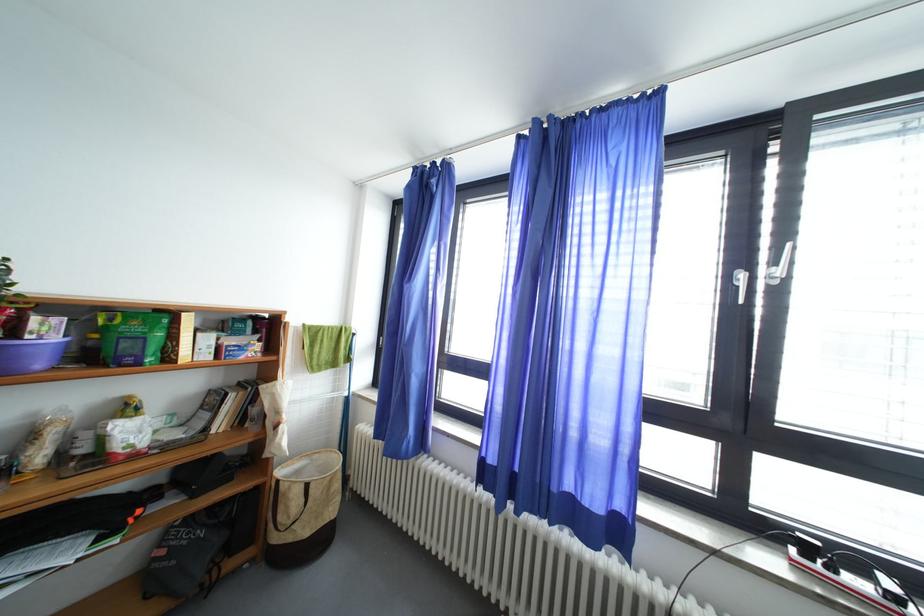
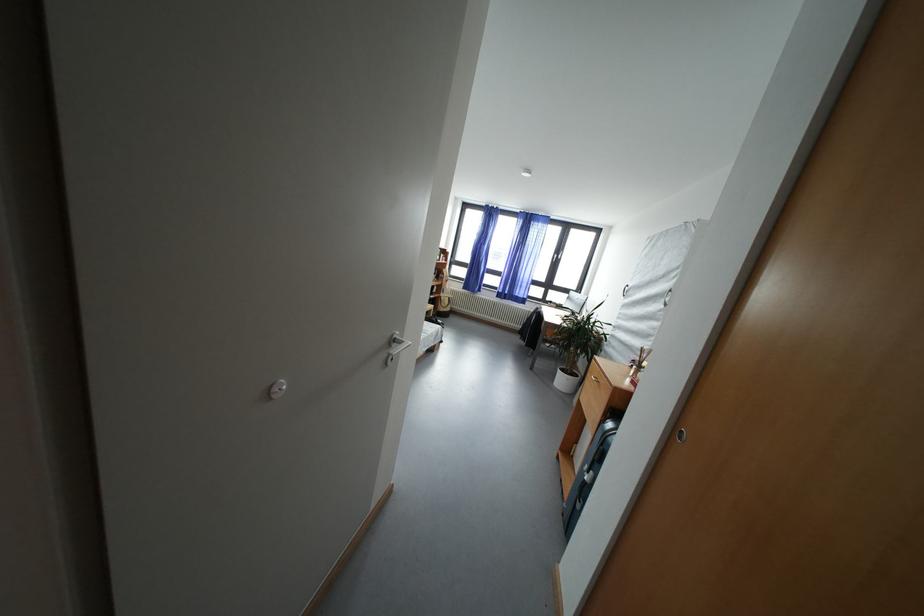
Which direction would the cameraman need to move to produce the second image?

The cameraman walked toward left, backward.